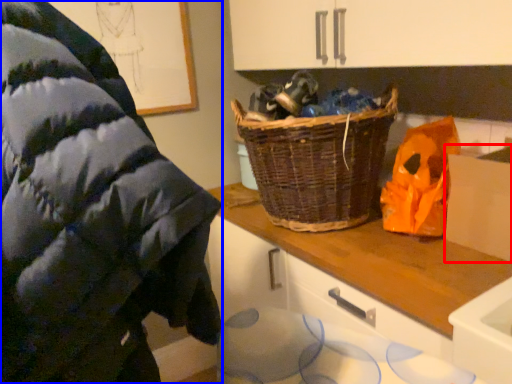
Question: Which point is further to the camera, cardboard box (highlighted by a red box) or wool (highlighted by a blue box)?

Choices:
 (A) cardboard box
 (B) wool

Answer: (A)